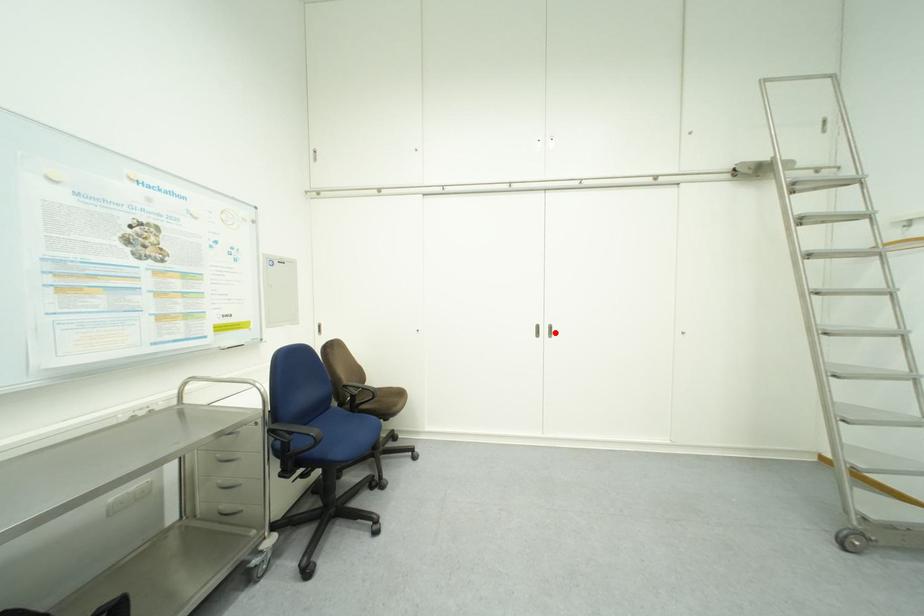
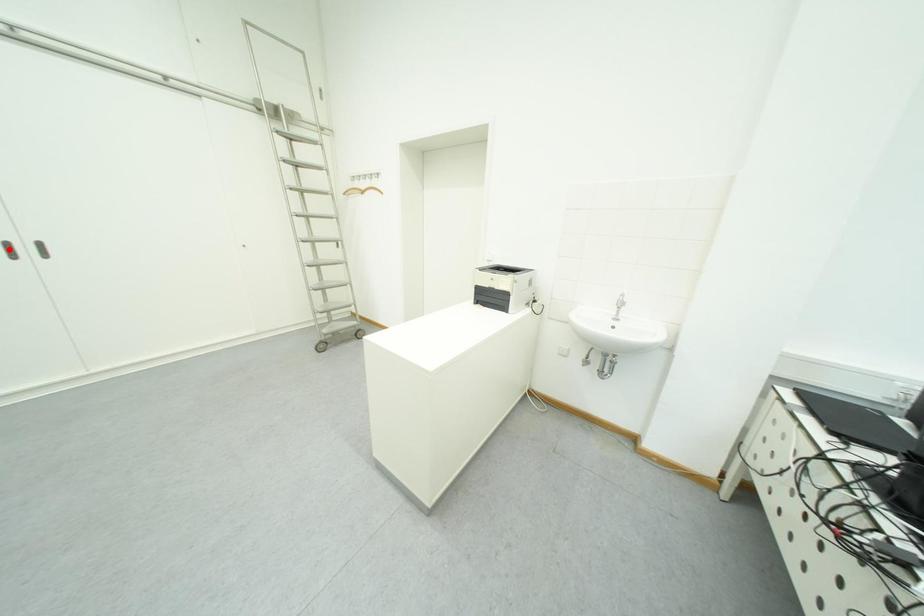
I am providing you with two images of the same scene from different viewpoints. A red point is marked on the first image and another point is marked on the second image. Is the marked point in image1 the same physical position as the marked point in image2?

No